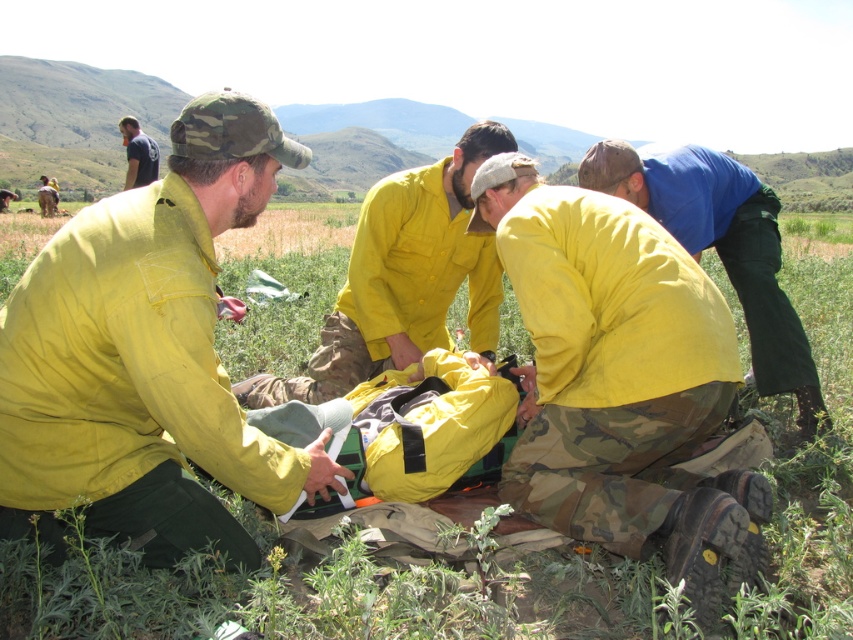
Is point (802, 404) less distant than point (138, 164)?

Yes.

Is point (757, 244) in front of point (151, 168)?

Yes, it is.

Identify the location of blue cotton shirt at upper right. This screenshot has width=853, height=640. (722, 250).

Which is in front, point (267, 476) or point (727, 228)?

Point (267, 476)

Identify the location of matte yellow jacket at left. (149, 356).

What do you see at coordinates (403, 278) in the screenshot? I see `yellow matte uniform at center` at bounding box center [403, 278].

In the scene shown: Does yellow matte uniform at center come in front of blue cotton shirt at upper right?

Yes, yellow matte uniform at center is closer to the viewer.

At what (x,y) coordinates should I click in order to perform the action: click on yellow matte uniform at center. Please return your answer as a coordinate pair (x, y). The width and height of the screenshot is (853, 640). Looking at the image, I should click on (403, 278).

Identify the location of yellow matte uniform at center. Image resolution: width=853 pixels, height=640 pixels. (403, 278).